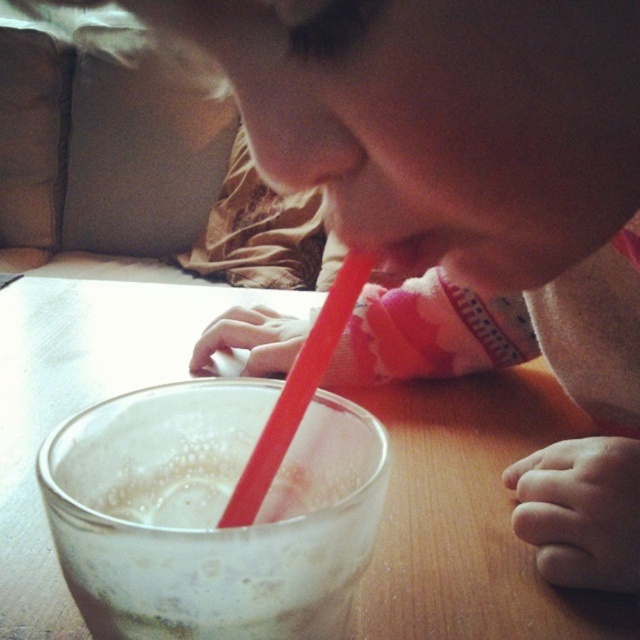
You are a child trying to reach the rubberized red straw at center while sitting at the transparent glass table at center. Can you comfortably reach the straw without moving your chair?

The transparent glass table at center is much taller than the rubberized red straw at center, so the straw is positioned lower than the table surface. This means the straw is likely within comfortable reach for the child without needing to move the chair.

You are a photographer aiming to capture a close shot of the white frothy liquid at center. To ensure the liquid is in focus, you need to adjust your camera focus. Considering the transparent glass table at center is between you and the liquid, is the glass table closer to you than the liquid?

The transparent glass table at center is further to the viewer than white frothy liquid at center, so the glass table is not closer to you than the liquid. The liquid is closer to you than the glass table.

You are a photographer trying to capture the white frothy liquid at center in the image. What coordinates should you focus on to ensure the liquid is in the center of your shot?

The white frothy liquid at center is located at coordinates (x=211, y=513), so you should focus your shot on those coordinates to center it.